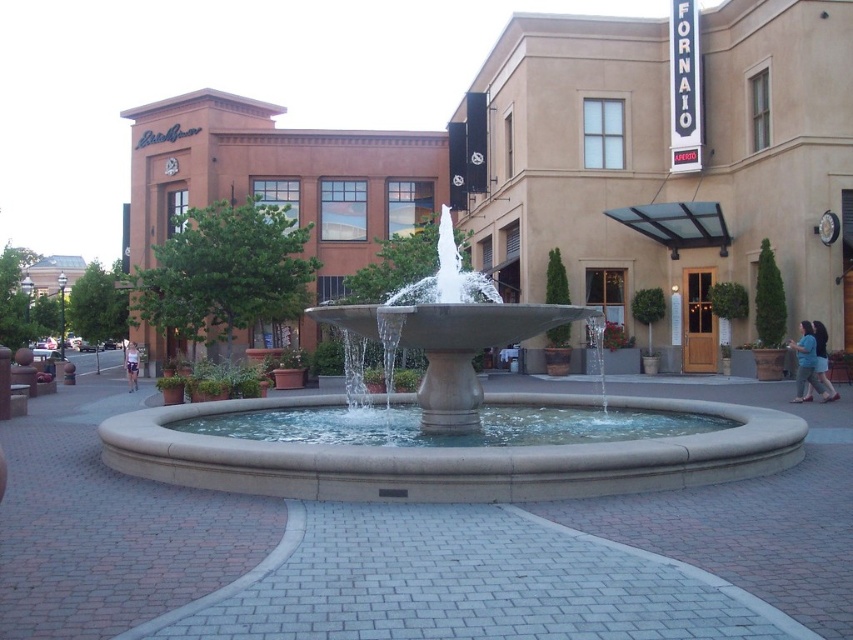
Between blue cotton shirt at lower right and denim skirt at lower right, which one has more height?

Standing taller between the two is denim skirt at lower right.

Identify the location of blue cotton shirt at lower right. (805, 362).

Is smooth concrete fountain at center to the left of denim shorts at center from the viewer's perspective?

In fact, smooth concrete fountain at center is to the right of denim shorts at center.

What do you see at coordinates (450, 420) in the screenshot?
I see `smooth concrete fountain at center` at bounding box center [450, 420].

Image resolution: width=853 pixels, height=640 pixels. What are the coordinates of `smooth concrete fountain at center` in the screenshot? It's located at (450, 420).

Measure the distance between point (x=517, y=406) and camera.

The distance of point (x=517, y=406) from camera is 13.03 meters.

Who is taller, smooth concrete fountain at center or blue cotton shirt at lower right?

smooth concrete fountain at center

Is point (689, 442) closer to camera compared to point (793, 342)?

Yes, point (689, 442) is closer to viewer.

Identify the location of smooth concrete fountain at center. Image resolution: width=853 pixels, height=640 pixels. (450, 420).